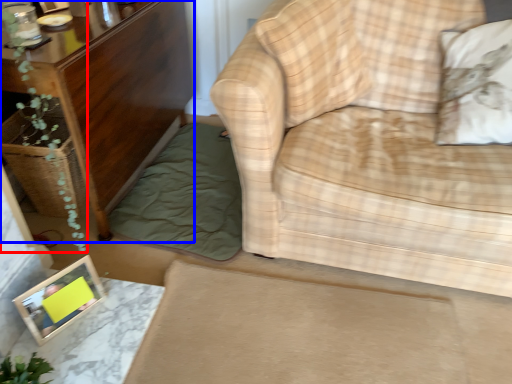
Question: Which of the following is the farthest to the observer, plant (highlighted by a red box) or furniture (highlighted by a blue box)?

Choices:
 (A) plant
 (B) furniture

Answer: (B)